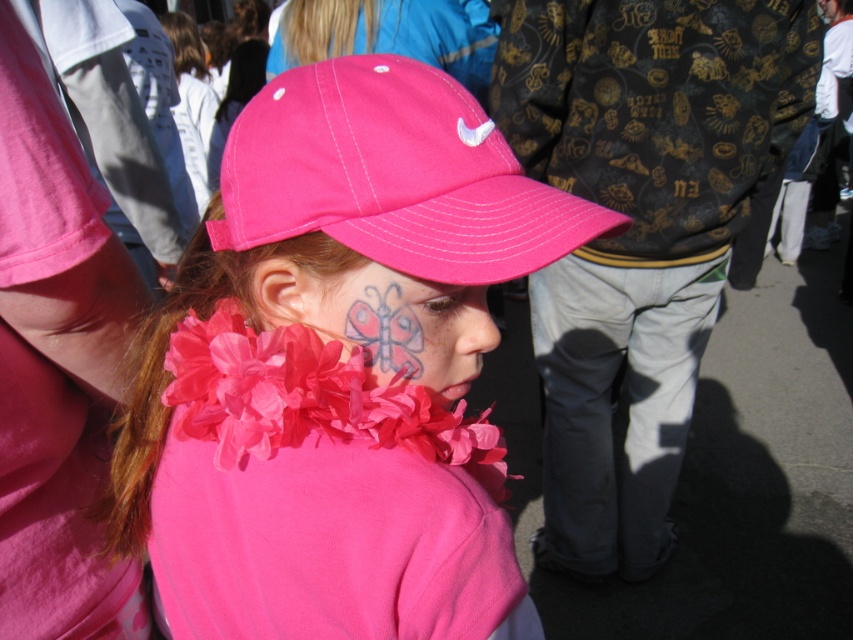
Between fluffy fabric flower at center and matte pink butterfly at center, which one has less height?

matte pink butterfly at center is shorter.

How much distance is there between fluffy fabric flower at center and matte pink butterfly at center?

1.82 inches

Between point (386, 410) and point (448, 380), which one is positioned behind?

The point (448, 380) is more distant.

You are a GUI agent. You are given a task and a screenshot of the screen. Output one action in this format:
    pyautogui.click(x=<x>, y=<y>)
    Task: Click on the fluffy fabric flower at center
    The height and width of the screenshot is (640, 853).
    Given the screenshot: What is the action you would take?
    pyautogui.click(x=310, y=397)

Consider the image. Does matte pink baseball cap at center have a lesser width compared to fluffy fabric flower at center?

In fact, matte pink baseball cap at center might be wider than fluffy fabric flower at center.

Is matte pink baseball cap at center above fluffy fabric flower at center?

Indeed, matte pink baseball cap at center is positioned over fluffy fabric flower at center.

Between point (283, 122) and point (286, 337), which one is positioned in front?

Positioned in front is point (283, 122).

Where is `matte pink baseball cap at center`? matte pink baseball cap at center is located at coordinates (393, 176).

Find the location of a particular element. matte pink cap at center is located at coordinates (345, 364).

Is point (390, 520) farther from camera compared to point (270, 243)?

No, (390, 520) is in front of (270, 243).

This screenshot has width=853, height=640. Identify the location of matte pink cap at center. (345, 364).